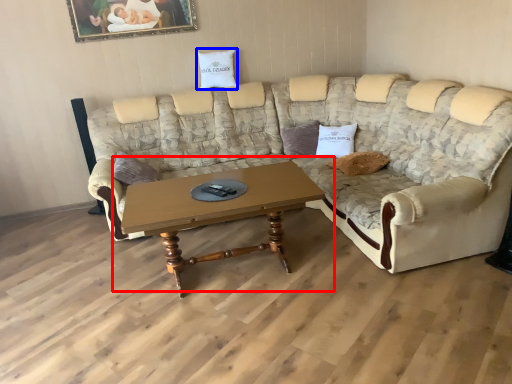
Question: Which object is closer to the camera taking this photo, coffee table (highlighted by a red box) or pillow (highlighted by a blue box)?

Choices:
 (A) coffee table
 (B) pillow

Answer: (A)